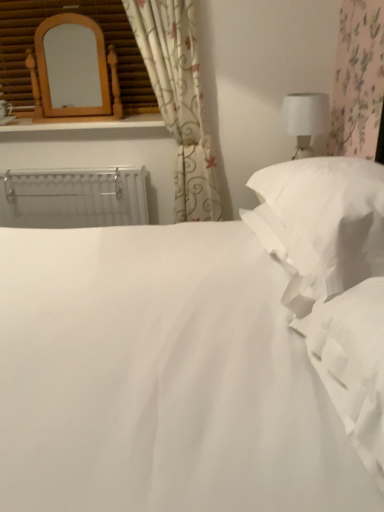
Question: Is white fabric at right bigger or smaller than white soft pillow at right?

Choices:
 (A) big
 (B) small

Answer: (B)

Question: Considering the positions of white fabric at right and white soft pillow at right in the image, is white fabric at right taller or shorter than white soft pillow at right?

Choices:
 (A) tall
 (B) short

Answer: (A)

Question: Which is nearer to the floral fabric curtain at upper left?

Choices:
 (A) white smooth bed at center
 (B) white soft pillow at right
 (C) white fabric at right
 (D) white matte table lamp at upper right
 (E) white metallic radiator at left

Answer: (D)

Question: Which is nearer to the white fabric at right?

Choices:
 (A) floral fabric curtain at upper left
 (B) white soft pillow at right
 (C) white matte table lamp at upper right
 (D) white smooth bed at center
 (E) wooden mirror at upper left

Answer: (D)